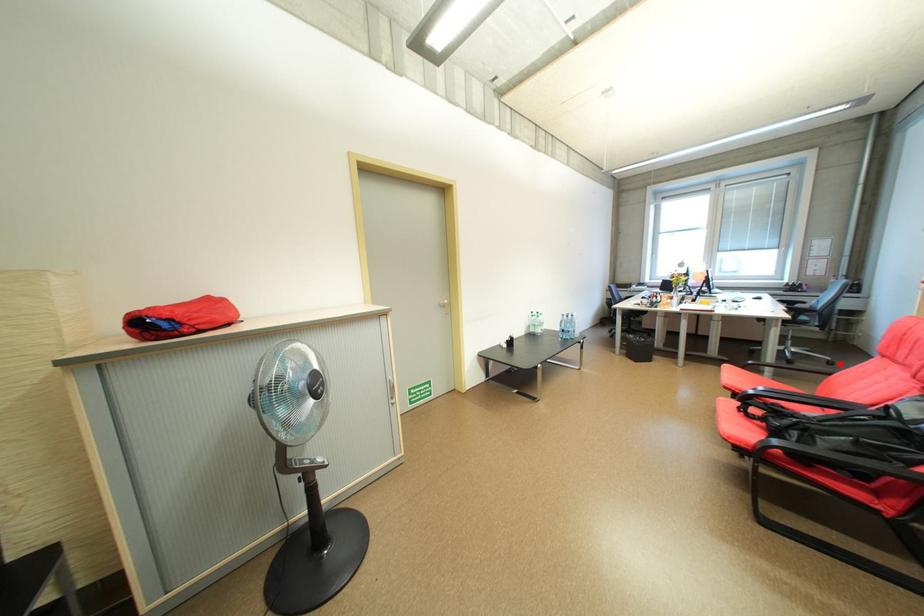
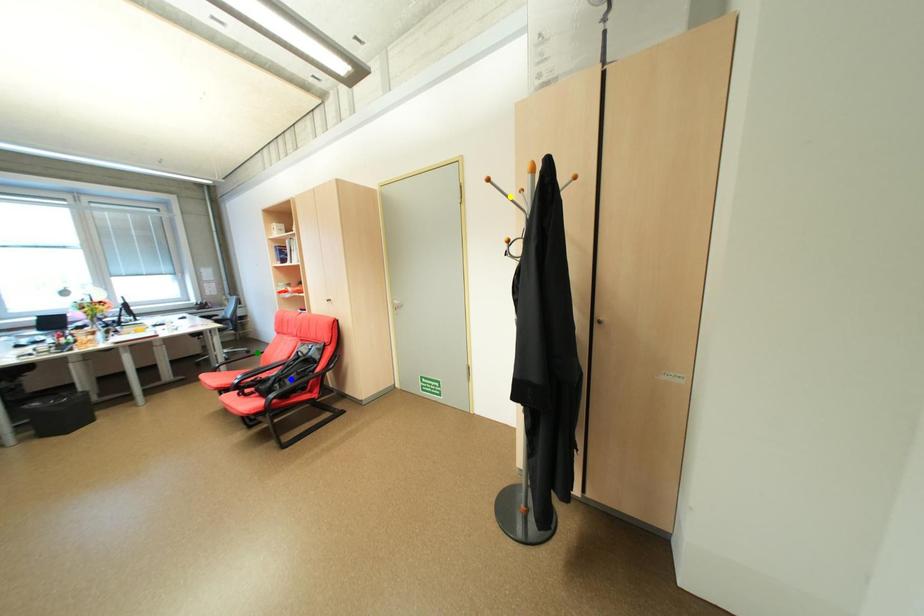
Question: I am providing you with two images of the same scene from different viewpoints. A red point is marked on the first image. You are given multiple points on the second image. Which spot in image 2 lines up with the point in image 1?

Choices:
 (A) green point
 (B) blue point
 (C) yellow point

Answer: (A)